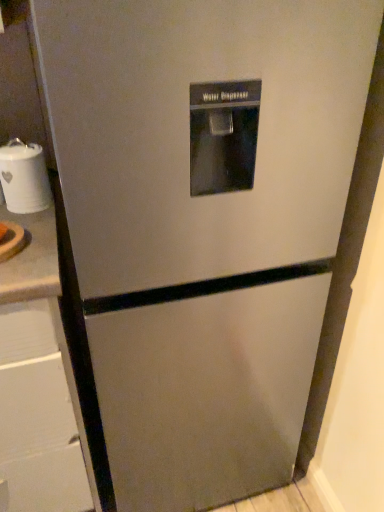
The image size is (384, 512). Find the location of `free space in front of white ceramic jar at left`. free space in front of white ceramic jar at left is located at coordinates (32, 230).